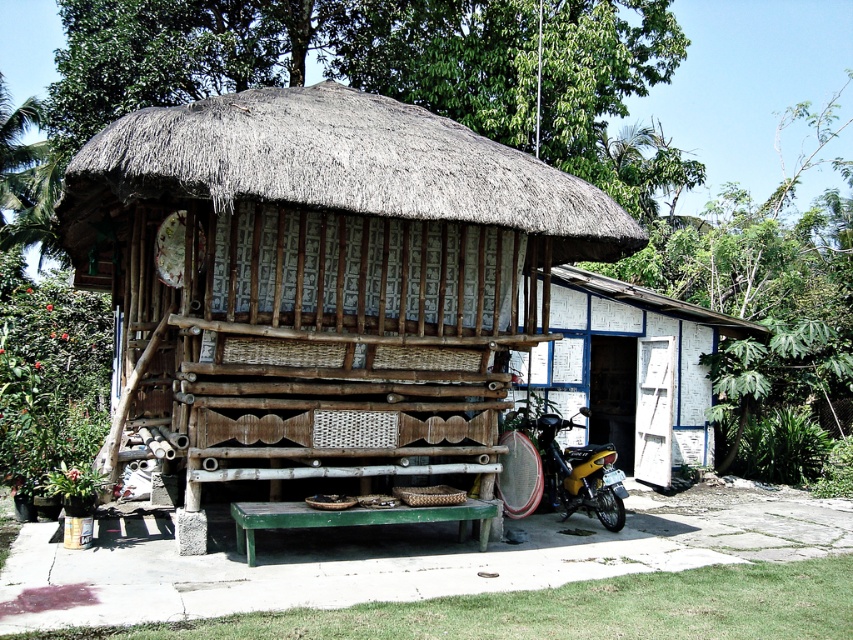
You are planning to place a new decorative item on the white painted wood at right and the yellow matte motorcycle at lower right. Since you want them to look balanced, which object should you choose to place a larger item on?

You should place the larger item on the white painted wood at right because its width is larger than the yellow matte motorcycle at lower right, allowing it to support a bigger decorative item without looking unbalanced.

You are standing on the ground level near the bamboo hut at center and want to reach the white painted wood at right. Which direction should you move to get there?

The bamboo hut at center is located above the white painted wood at right, so you should move downward to reach the white painted wood at right.